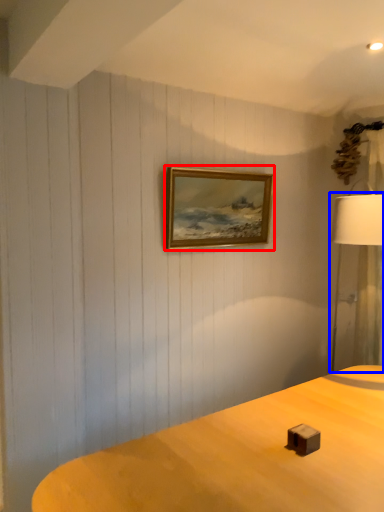
Question: Which object appears farthest to the camera in this image, picture frame (highlighted by a red box) or lamp (highlighted by a blue box)?

Choices:
 (A) picture frame
 (B) lamp

Answer: (A)